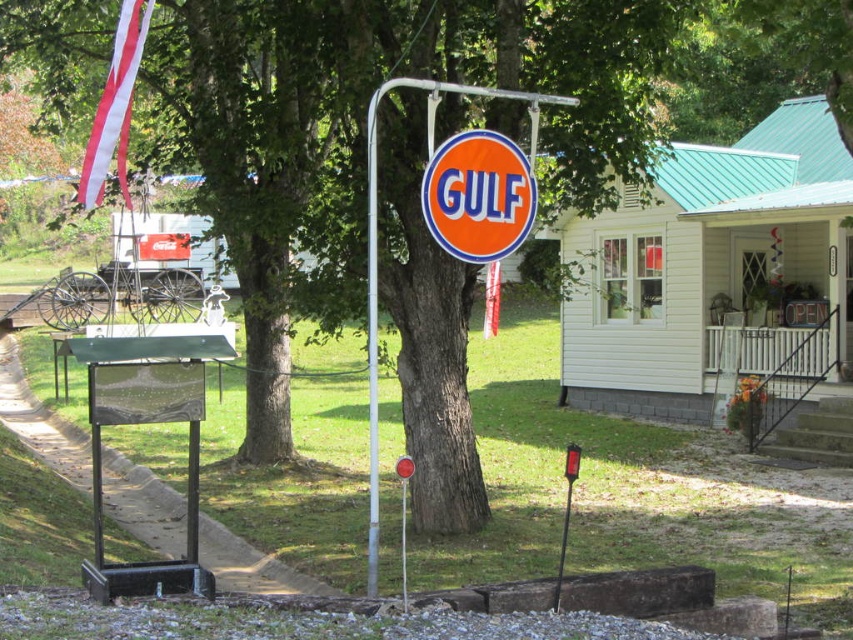
Question: Which of the following is the farthest from the observer?

Choices:
 (A) metallic red stop sign at center
 (B) metallic pole at center
 (C) green glossy sign at lower left
 (D) orange glossy sign at center

Answer: (B)

Question: Estimate the real-world distances between objects in this image. Which object is farther from the orange glossy sign at center?

Choices:
 (A) red plastic sign at lower center
 (B) metallic red stop sign at center
 (C) metallic pole at center
 (D) green glossy sign at lower left

Answer: (D)

Question: Observing the image, what is the correct spatial positioning of orange glossy sign at center in reference to metallic red stop sign at center?

Choices:
 (A) below
 (B) above

Answer: (B)

Question: Is orange glossy sign at center further to camera compared to metallic red stop sign at center?

Choices:
 (A) yes
 (B) no

Answer: (A)

Question: Is orange glossy sign at center closer to the viewer compared to red plastic sign at lower center?

Choices:
 (A) no
 (B) yes

Answer: (A)

Question: Which of these objects is positioned farthest from the orange glossy sign at center?

Choices:
 (A) red plastic sign at lower center
 (B) metallic red stop sign at center
 (C) metallic pole at center
 (D) green glossy sign at lower left

Answer: (D)